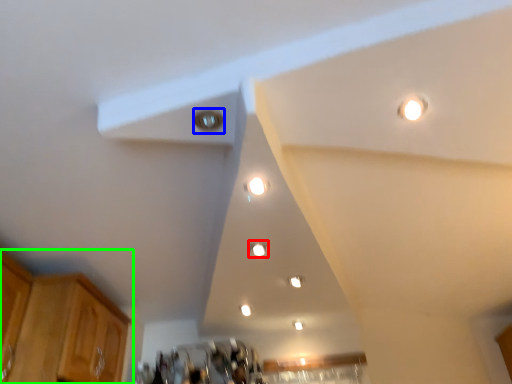
Question: Estimate the real-world distances between objects in this image. Which object is closer to dot (highlighted by a red box), light (highlighted by a blue box) or cabinetry (highlighted by a green box)?

Choices:
 (A) light
 (B) cabinetry

Answer: (A)